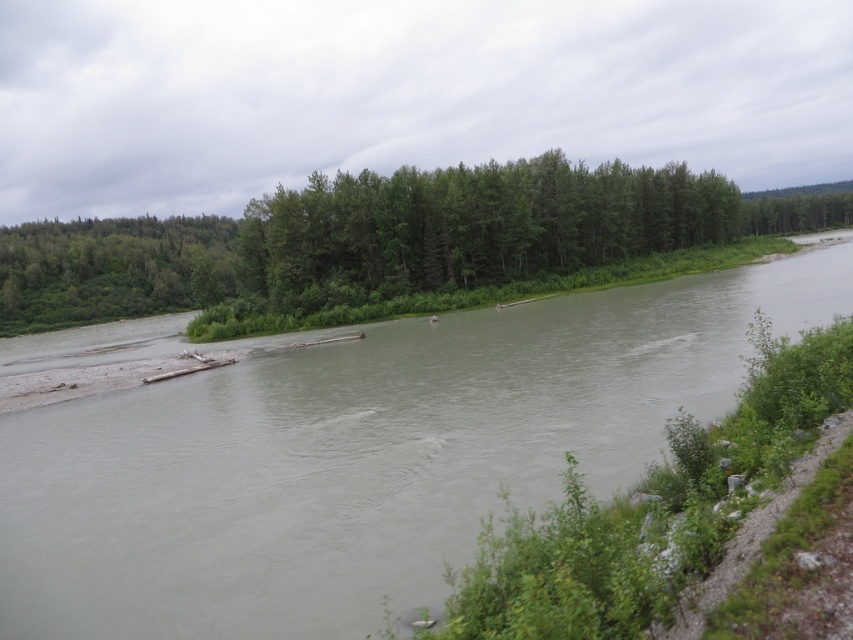
Does point (78, 355) lie in front of point (637, 244)?

Yes.

Which is in front, point (659, 326) or point (289, 300)?

Point (659, 326) is in front.

The image size is (853, 640). Identify the location of brown muddy water at center. (352, 451).